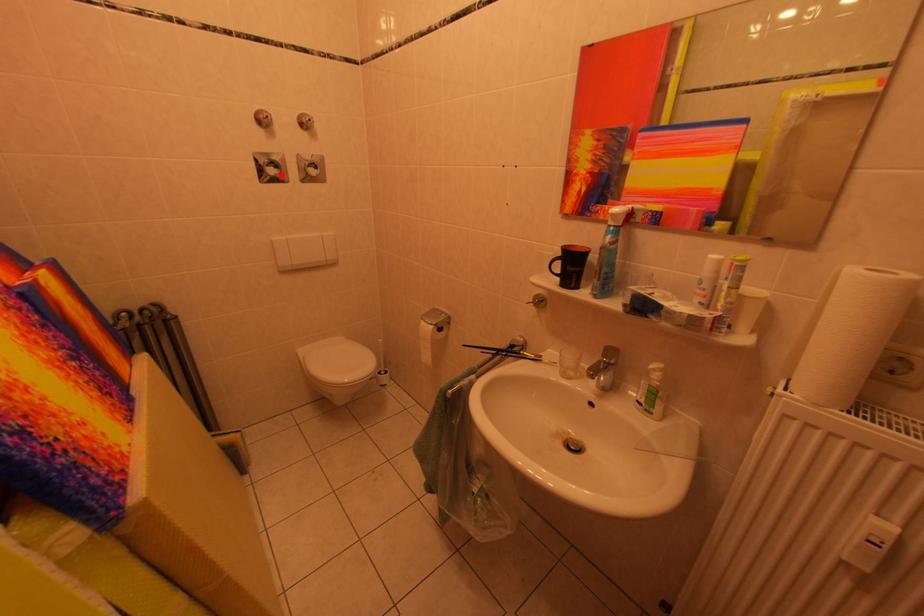
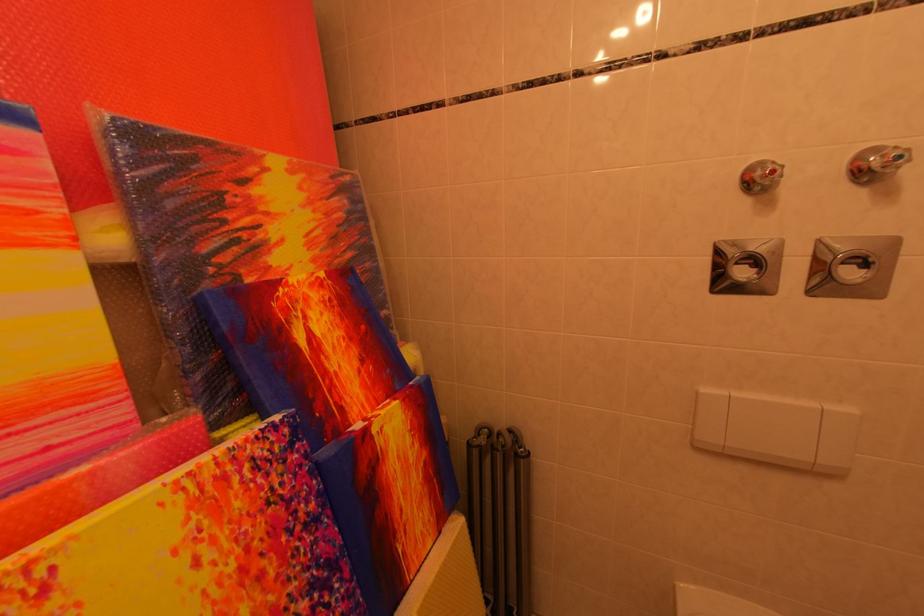
The point at the highlighted location is marked in the first image. Where is the corresponding point in the second image?

(751, 277)